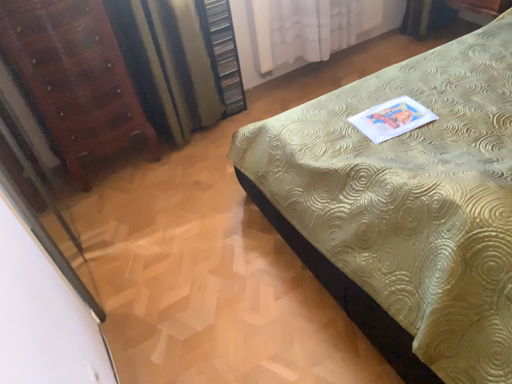
Locate an element on the screen. The height and width of the screenshot is (384, 512). spots to the right of transparent glass screen door at left is located at coordinates (170, 245).